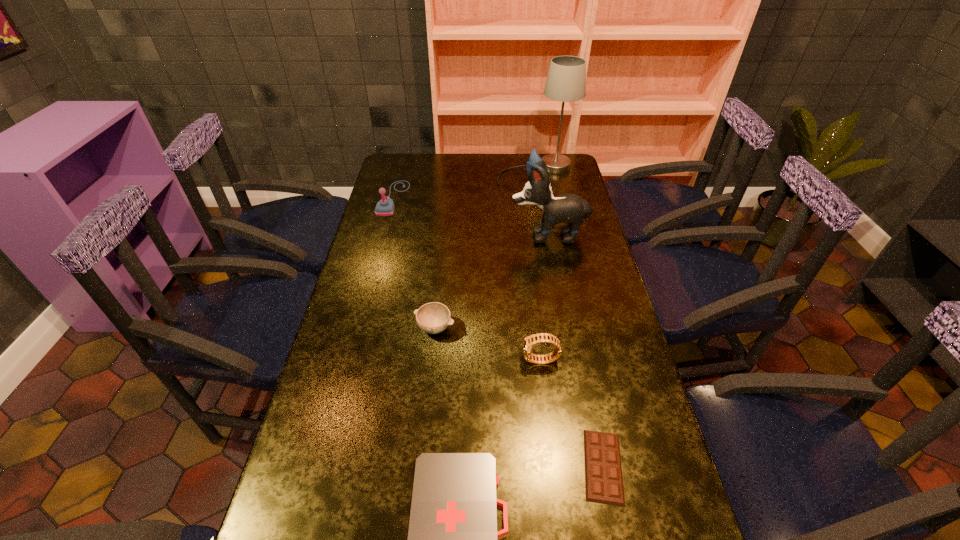
The height and width of the screenshot is (540, 960). I want to click on object located in the left edge section of the desktop, so click(x=385, y=207).

I want to click on table lamp positioned at the right edge, so click(x=566, y=82).

Locate an element on the screen. The height and width of the screenshot is (540, 960). puppy that is at the right edge is located at coordinates (567, 208).

The image size is (960, 540). What are the coordinates of `chocolate bar at the right edge` in the screenshot? It's located at (603, 473).

Locate an element on the screen. This screenshot has height=540, width=960. object that is at the far left corner is located at coordinates (385, 207).

The image size is (960, 540). Identify the location of object present at the far right corner. (566, 82).

What are the coordinates of `vacant space at the far edge of the desktop` in the screenshot? It's located at pyautogui.click(x=449, y=156).

Where is `free space at the left edge of the desktop`? free space at the left edge of the desktop is located at coordinates (342, 339).

You are a GUI agent. You are given a task and a screenshot of the screen. Output one action in this format:
    pyautogui.click(x=<x>, y=<y>)
    Task: Click on the free region at the right edge of the desktop
    The width and height of the screenshot is (960, 540).
    Given the screenshot: What is the action you would take?
    pyautogui.click(x=622, y=451)

In the image, there is a desktop. Find the location of `free space at the far left corner`. free space at the far left corner is located at coordinates (411, 178).